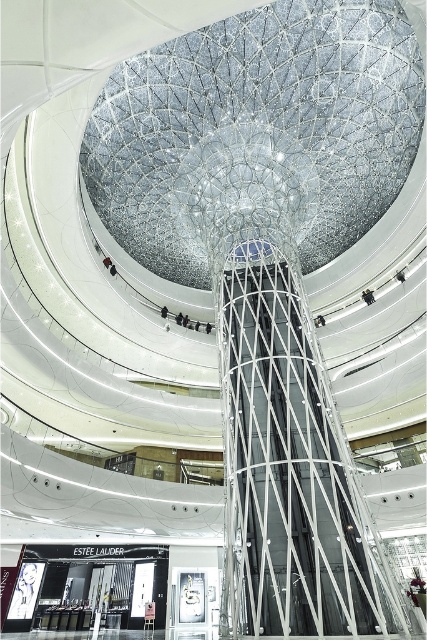
Question: Can you confirm if transparent glass dome at center is positioned above metallic wireframe escalator at center?

Choices:
 (A) no
 (B) yes

Answer: (B)

Question: Is transparent glass dome at center bigger than metallic wireframe escalator at center?

Choices:
 (A) yes
 (B) no

Answer: (A)

Question: Which point is closer to the camera?

Choices:
 (A) metallic wireframe escalator at center
 (B) transparent glass dome at center

Answer: (A)

Question: Can you confirm if transparent glass dome at center is thinner than metallic wireframe escalator at center?

Choices:
 (A) yes
 (B) no

Answer: (B)